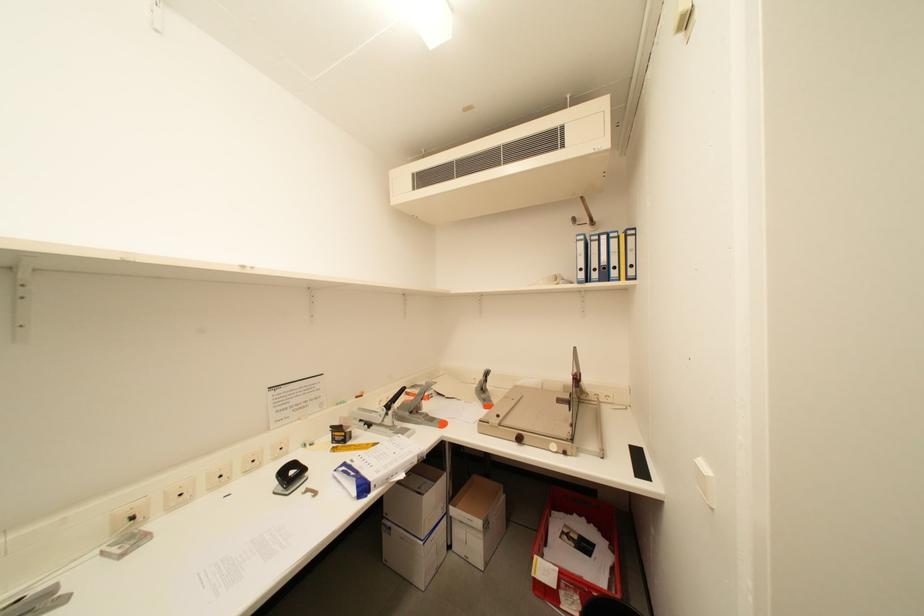
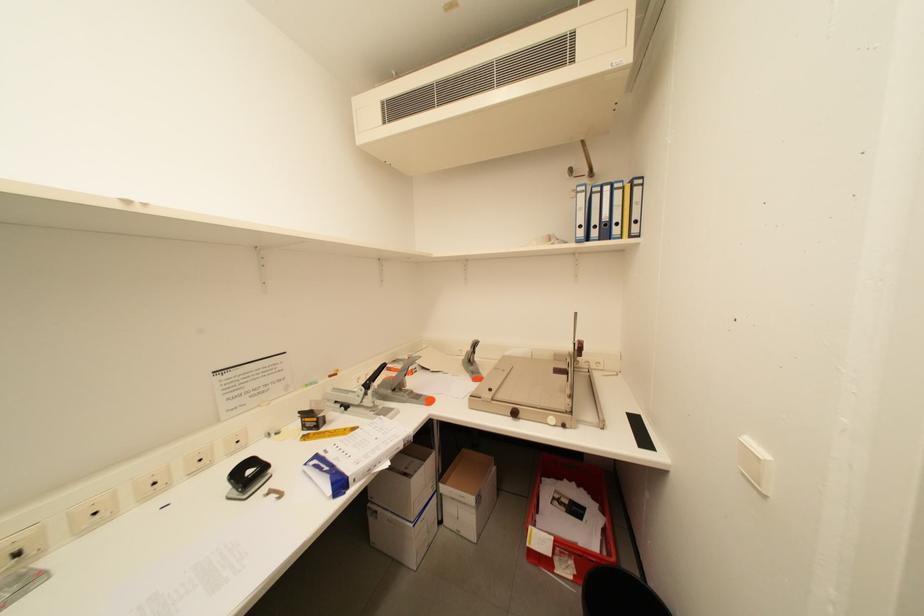
Question: Based on the continuous images, in which direction is the camera rotating? Reply with the corresponding letter.

Choices:
 (A) Left
 (B) Right
 (C) Up
 (D) Down

Answer: (D)